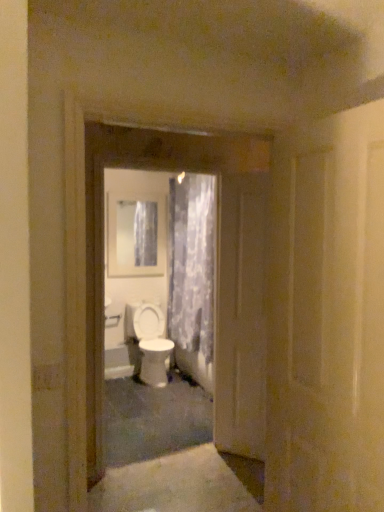
In order to face white glossy door at center, which is the third door from back to front, should I rotate leftwards or rightwards?

You should rotate right by 17.343 degrees.

Image resolution: width=384 pixels, height=512 pixels. Describe the element at coordinates (218, 252) in the screenshot. I see `white glossy door at center, arranged as the second door when viewed from the back` at that location.

Measure the distance between point (194, 265) and camera.

4.31 meters.

Describe the element at coordinates (240, 315) in the screenshot. Image resolution: width=384 pixels, height=512 pixels. I see `white glossy door at center, which is the first door in back-to-front order` at that location.

Image resolution: width=384 pixels, height=512 pixels. In order to click on white glossy medicine cabinet at upper center in this screenshot , I will do `click(135, 234)`.

Based on the photo, does white glossy toilet at center have a smaller size compared to white glossy door at center, arranged as the second door when viewed from the back?

Indeed, white glossy toilet at center has a smaller size compared to white glossy door at center, arranged as the second door when viewed from the back.

How many degrees apart are the facing directions of white glossy toilet at center and white glossy door at center, which is the 2th door in front-to-back order?

1.16 degrees.

From the image's perspective, is white glossy toilet at center under white glossy door at center, which is the 2th door in front-to-back order?

Yes, from the image's perspective, white glossy toilet at center is beneath white glossy door at center, which is the 2th door in front-to-back order.

Between point (133, 265) and point (153, 337), which one is positioned in front?

Positioned in front is point (153, 337).

Looking at their sizes, would you say white glossy medicine cabinet at upper center is wider or thinner than white glossy toilet at center?

Clearly, white glossy medicine cabinet at upper center has less width compared to white glossy toilet at center.

From the picture: From a real-world perspective, is white glossy medicine cabinet at upper center positioned above or below white glossy toilet at center?

In terms of real-world spatial position, white glossy medicine cabinet at upper center is above white glossy toilet at center.

Who is taller, white glossy medicine cabinet at upper center or white glossy toilet at center?

white glossy medicine cabinet at upper center is taller.

In the scene shown: Can you confirm if translucent floral fabric at center is smaller than white glossy door at center, which is the third door from back to front?

Actually, translucent floral fabric at center might be larger than white glossy door at center, which is the third door from back to front.

Is point (205, 321) less distant than point (365, 443)?

That is False.

Is translucent floral fabric at center in front of or behind white glossy door at center, placed as the first door when sorted from front to back, in the image?

Clearly, translucent floral fabric at center is behind white glossy door at center, placed as the first door when sorted from front to back.

How many degrees apart are the facing directions of translucent floral fabric at center and white glossy door at center, which is the third door from back to front?

The angle between the facing direction of translucent floral fabric at center and the facing direction of white glossy door at center, which is the third door from back to front, is 3.76 degrees.

Considering the relative sizes of white glossy door at center, which is the first door in back-to-front order, and translucent floral fabric at center in the image provided, is white glossy door at center, which is the first door in back-to-front order, smaller than translucent floral fabric at center?

Yes, white glossy door at center, which is the first door in back-to-front order, is smaller than translucent floral fabric at center.

Find the location of a particular element. Image resolution: width=384 pixels, height=512 pixels. curtain above the white glossy door at center, positioned as the 3th door in front-to-back order (from the image's perspective) is located at coordinates (192, 263).

Is the surface of white glossy door at center, which is the first door in back-to-front order, in direct contact with translucent floral fabric at center?

There is a gap between white glossy door at center, which is the first door in back-to-front order, and translucent floral fabric at center.

From the image's perspective, between white glossy door at center, which is the first door in back-to-front order, and translucent floral fabric at center, who is located below?

From the image's view, white glossy door at center, which is the first door in back-to-front order, is below.

From a real-world perspective, does white glossy door at center, positioned as the 3th door in front-to-back order, sit lower than white glossy toilet at center?

No.

Is white glossy door at center, positioned as the 3th door in front-to-back order, to the left of white glossy toilet at center from the viewer's perspective?

No, white glossy door at center, positioned as the 3th door in front-to-back order, is not to the left of white glossy toilet at center.

Is white glossy toilet at center a part of white glossy door at center, positioned as the 3th door in front-to-back order?

No, white glossy door at center, positioned as the 3th door in front-to-back order, does not contain white glossy toilet at center.

From a real-world perspective, is white glossy door at center, positioned as the 3th door in front-to-back order, above or below white glossy medicine cabinet at upper center?

white glossy door at center, positioned as the 3th door in front-to-back order, is below white glossy medicine cabinet at upper center.

Considering the positions of objects white glossy door at center, positioned as the 3th door in front-to-back order, and white glossy medicine cabinet at upper center in the image provided, who is more to the left, white glossy door at center, positioned as the 3th door in front-to-back order, or white glossy medicine cabinet at upper center?

white glossy medicine cabinet at upper center is more to the left.

Are white glossy door at center, which is the first door in back-to-front order, and white glossy medicine cabinet at upper center located far from each other?

Yes.

Who is more distant, white glossy door at center, positioned as the 3th door in front-to-back order, or white glossy medicine cabinet at upper center?

white glossy medicine cabinet at upper center is behind.

Is white glossy toilet at center further to camera compared to translucent floral fabric at center?

Yes, it is.

Are white glossy toilet at center and translucent floral fabric at center beside each other?

No, white glossy toilet at center is not with translucent floral fabric at center.

Would you say white glossy toilet at center is outside translucent floral fabric at center?

Yes, white glossy toilet at center is located beyond the bounds of translucent floral fabric at center.

I want to click on the 2nd door positioned above the white glossy toilet at center (from a real-world perspective), so click(218, 252).

I want to click on toilet in front of the white glossy medicine cabinet at upper center, so click(x=152, y=344).

When comparing their distances from white glossy toilet at center, does translucent floral fabric at center or white glossy door at center, which is the 2th door in front-to-back order, seem closer?

The object closer to white glossy toilet at center is translucent floral fabric at center.

Based on their spatial positions, is translucent floral fabric at center or white glossy door at center, which is the third door from back to front, further from white glossy door at center, which is the first door in back-to-front order?

The object further to white glossy door at center, which is the first door in back-to-front order, is translucent floral fabric at center.

From the image, which object appears to be farther from white glossy door at center, arranged as the second door when viewed from the back, white glossy medicine cabinet at upper center or white glossy door at center, placed as the first door when sorted from front to back?

Among the two, white glossy medicine cabinet at upper center is located further to white glossy door at center, arranged as the second door when viewed from the back.

Estimate the real-world distances between objects in this image. Which object is closer to white glossy door at center, which is the third door from back to front, white glossy medicine cabinet at upper center or white glossy door at center, positioned as the 3th door in front-to-back order?

Based on the image, white glossy door at center, positioned as the 3th door in front-to-back order, appears to be nearer to white glossy door at center, which is the third door from back to front.

Looking at the image, which one is located closer to white glossy door at center, which is the third door from back to front, translucent floral fabric at center or white glossy toilet at center?

translucent floral fabric at center is closer to white glossy door at center, which is the third door from back to front.

Which object lies nearer to the anchor point white glossy door at center, which is the 2th door in front-to-back order, white glossy medicine cabinet at upper center or translucent floral fabric at center?

The object closer to white glossy door at center, which is the 2th door in front-to-back order, is translucent floral fabric at center.

Based on their spatial positions, is white glossy door at center, placed as the first door when sorted from front to back, or white glossy door at center, arranged as the second door when viewed from the back, closer to white glossy toilet at center?

Based on the image, white glossy door at center, arranged as the second door when viewed from the back, appears to be nearer to white glossy toilet at center.

From the image, which object appears to be nearer to white glossy medicine cabinet at upper center, white glossy door at center, which is the 2th door in front-to-back order, or translucent floral fabric at center?

Among the two, translucent floral fabric at center is located nearer to white glossy medicine cabinet at upper center.

The width and height of the screenshot is (384, 512). I want to click on door between white glossy door at center, arranged as the second door when viewed from the back, and translucent floral fabric at center, along the z-axis, so click(240, 315).

What are the coordinates of `door between white glossy door at center, which is the third door from back to front, and white glossy door at center, positioned as the 3th door in front-to-back order, in the front-back direction` in the screenshot? It's located at (218, 252).

In order to click on curtain between white glossy door at center, which is the 2th door in front-to-back order, and white glossy toilet at center, along the z-axis in this screenshot , I will do `click(192, 263)`.

In order to click on door between white glossy door at center, which is the 2th door in front-to-back order, and white glossy toilet at center in the front-back direction in this screenshot , I will do `click(240, 315)`.